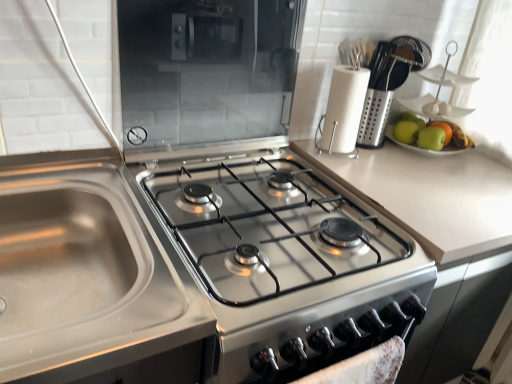
Where is `free space in front of green matte apple at upper right, acting as the 2th apple starting from the right`? Image resolution: width=512 pixels, height=384 pixels. free space in front of green matte apple at upper right, acting as the 2th apple starting from the right is located at coordinates (442, 172).